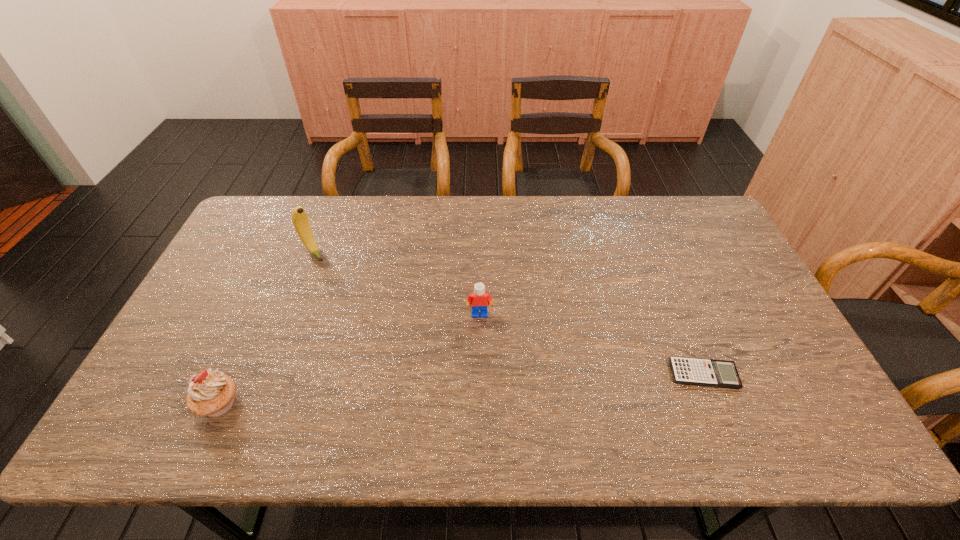
You are a GUI agent. You are given a task and a screenshot of the screen. Output one action in this format:
    pyautogui.click(x=<x>, y=<y>)
    Task: Click on the vacant space situated 0.200m on the face of the second farthest object
    The width and height of the screenshot is (960, 540).
    Given the screenshot: What is the action you would take?
    pyautogui.click(x=483, y=381)

Identify the location of vacant position located 0.230m on the face of the second farthest object. The width and height of the screenshot is (960, 540). 483,392.

Locate an element on the screen. The height and width of the screenshot is (540, 960). free location located 0.320m from the stem of the banana is located at coordinates (371, 320).

Where is `vacant region located from the stem of the banana`? vacant region located from the stem of the banana is located at coordinates (372, 322).

Locate an element on the screen. This screenshot has width=960, height=540. vacant space located 0.100m from the stem of the banana is located at coordinates (334, 276).

At what (x,y) coordinates should I click in order to perform the action: click on cupcake that is positioned at the near edge. Please return your answer as a coordinate pair (x, y). Looking at the image, I should click on (211, 393).

Image resolution: width=960 pixels, height=540 pixels. In order to click on calculator that is positioned at the near edge in this screenshot , I will do 693,371.

Image resolution: width=960 pixels, height=540 pixels. I want to click on object present at the left edge, so click(x=211, y=393).

The width and height of the screenshot is (960, 540). I want to click on object located at the near left corner, so click(x=211, y=393).

In order to click on free space at the far edge of the desktop in this screenshot , I will do `click(346, 224)`.